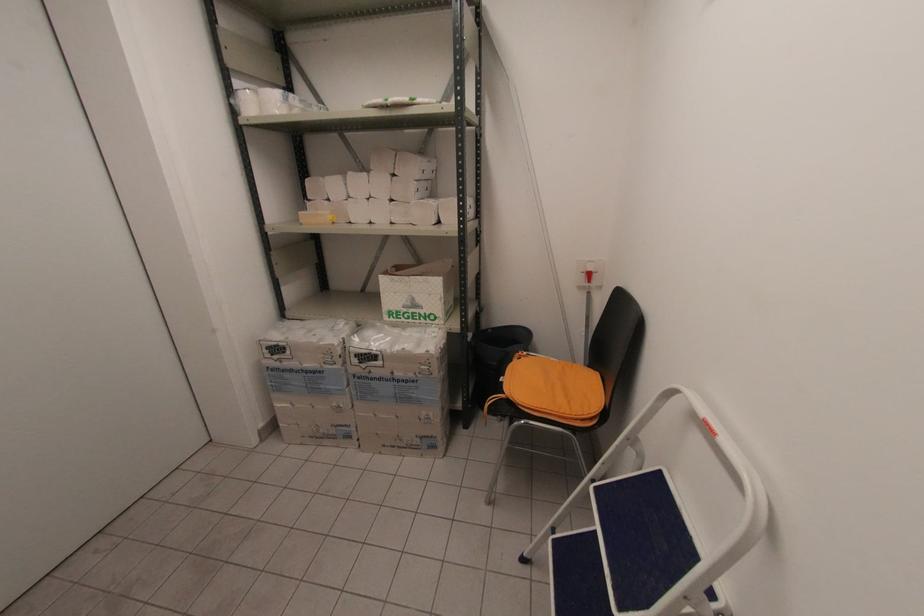
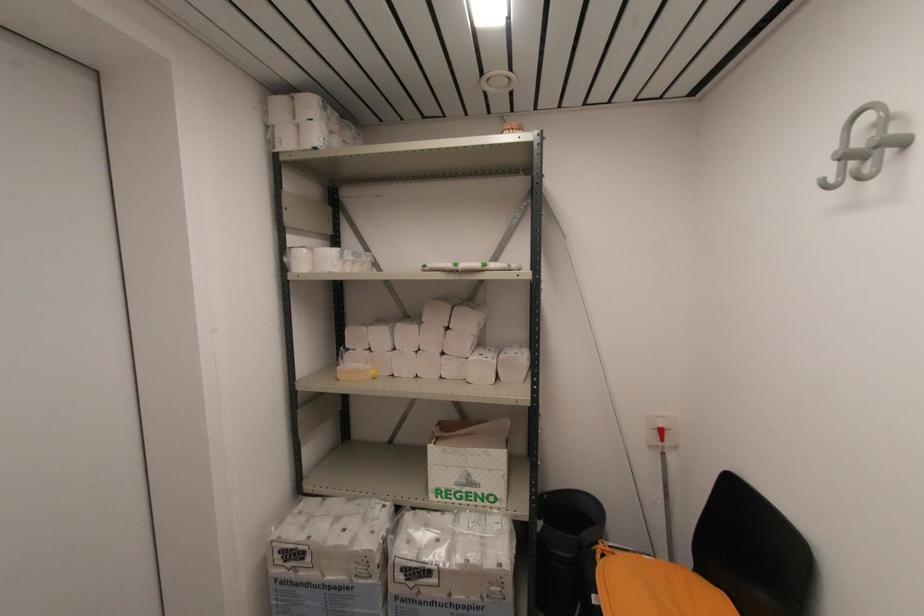
Find the pixel in the second image that matches (x=268, y=350) in the first image.

(281, 553)